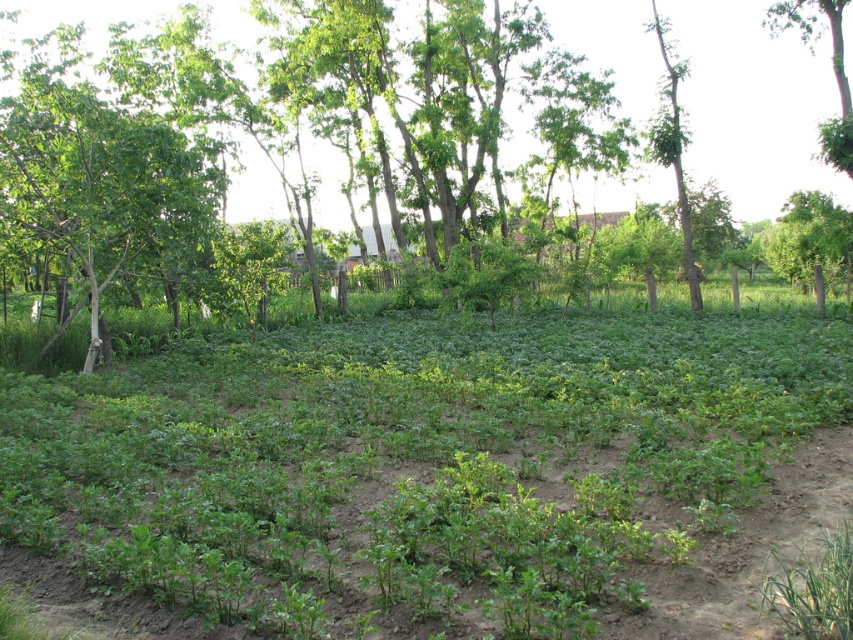
You are standing at the edge of the field looking towards the wooden fence. There is a point marked at coordinates (753, 104). What does this point indicate?

The point at coordinates (753, 104) marks the location of the green leafy tree at center.

You are a farmer inspecting your field and see the green leafy tree at center and the green rough bark tree at upper right. Which tree is closer to the left edge of the field?

The green leafy tree at center is positioned on the left side of green rough bark tree at upper right, so it is closer to the left edge of the field.

You are standing in the middle of the potato field and notice two trees in the background. Which tree, the green leafy tree at center or the green rough bark tree at upper right, is positioned higher up in the image?

The green leafy tree at center is located above the green rough bark tree at upper right, so it is positioned higher up in the image.